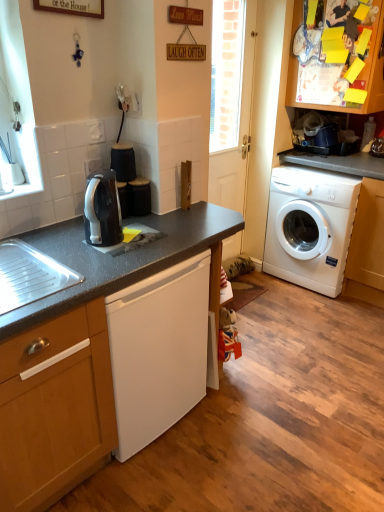
Find the location of a particular element. unoccupied area in front of white plastic washing machine at right is located at coordinates (x=318, y=313).